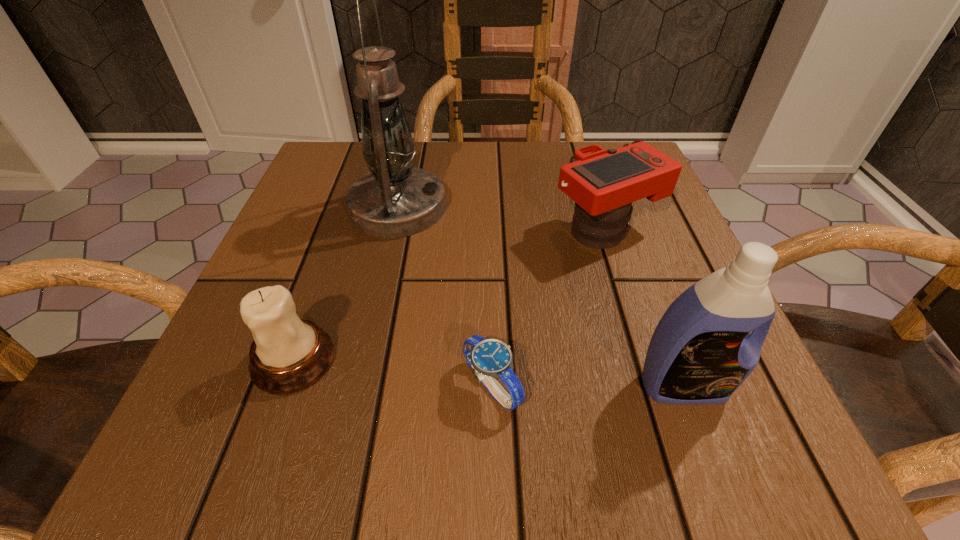
You are a GUI agent. You are given a task and a screenshot of the screen. Output one action in this format:
    pyautogui.click(x=<x>, y=<y>)
    Task: Click on the vacant space located on the left of the shortest object
    Image resolution: width=960 pixels, height=540 pixels.
    Given the screenshot: What is the action you would take?
    pyautogui.click(x=298, y=386)

What are the coordinates of `object located in the far edge section of the desktop` in the screenshot? It's located at (396, 199).

Find the location of a particular element. object situated at the near edge is located at coordinates (489, 358).

What are the coordinates of `oil lamp that is at the left edge` in the screenshot? It's located at (396, 199).

Find the location of `candle holder that is at the left edge`. candle holder that is at the left edge is located at coordinates (289, 354).

Locate an element on the screen. The height and width of the screenshot is (540, 960). detergent present at the right edge is located at coordinates (701, 351).

The height and width of the screenshot is (540, 960). I want to click on camera that is positioned at the right edge, so click(x=603, y=184).

Where is `object located in the far left corner section of the desktop`? This screenshot has width=960, height=540. object located in the far left corner section of the desktop is located at coordinates (396, 199).

Locate an element on the screen. vacant space at the far edge is located at coordinates (415, 164).

In the image, there is a desktop. Where is `vacant region at the left edge`? vacant region at the left edge is located at coordinates (349, 220).